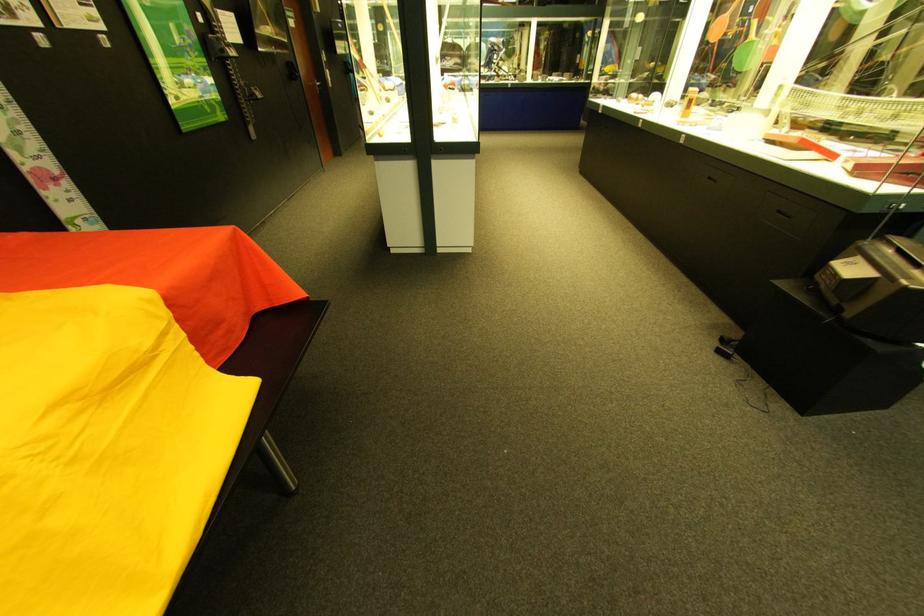
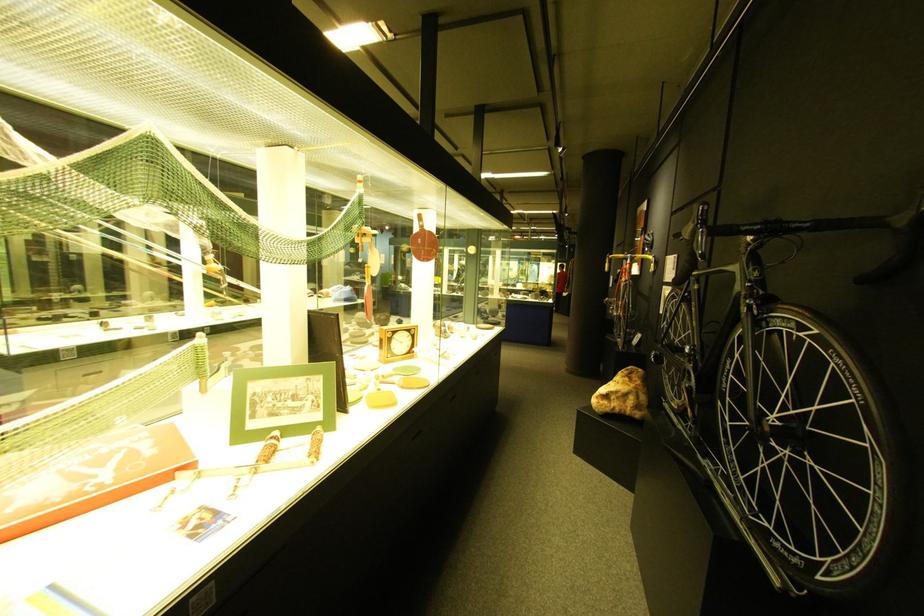
Question: I am providing you with two images of the same scene from different viewpoints. Please identify which objects are invisible in image2.

Choices:
 (A) black drawer pull
 (B) blind control chain
 (C) bicycle handlebar grip
 (D) yellow handlebar grip

Answer: (A)